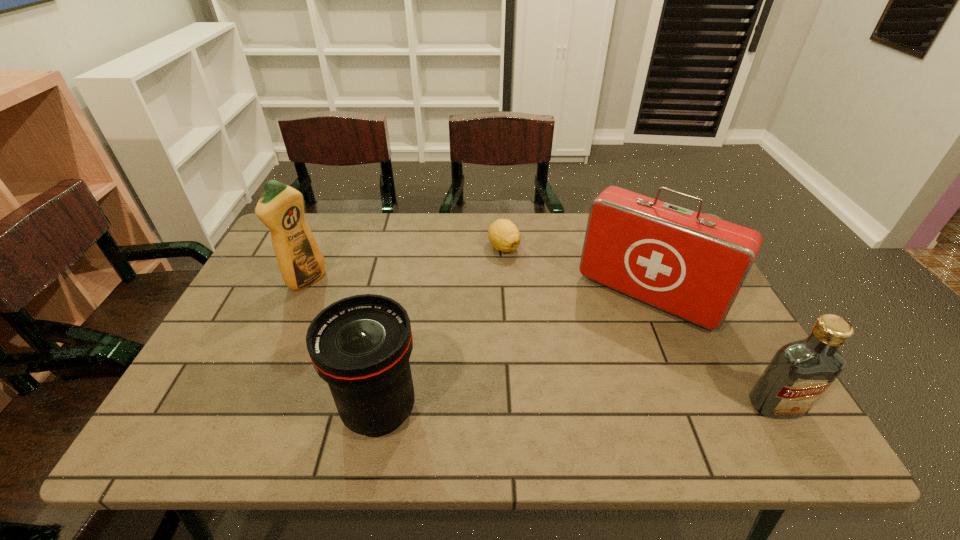
I want to click on vacant area that lies between the farthest object and the second object from left to right, so click(442, 329).

The width and height of the screenshot is (960, 540). I want to click on free spot between the farthest object and the first-aid kit, so click(x=576, y=272).

Find the location of a particular element. unoccupied position between the telephoto lens and the vodka is located at coordinates pos(578,408).

Locate an element on the screen. This screenshot has height=540, width=960. empty space between the vodka and the third object from left to right is located at coordinates (640, 326).

Locate an element on the screen. empty space that is in between the vodka and the lemon is located at coordinates (640, 326).

Where is `free space between the shortest object and the first-aid kit`? The height and width of the screenshot is (540, 960). free space between the shortest object and the first-aid kit is located at coordinates [576, 272].

Identify the location of free space between the vodka and the detergent. (541, 342).

Locate an element on the screen. The width and height of the screenshot is (960, 540). free point between the first-aid kit and the telephoto lens is located at coordinates (514, 353).

The image size is (960, 540). I want to click on object that is the second closest one to the farthest object, so click(360, 345).

What are the coordinates of `object that is the closest to the leftmost object` in the screenshot? It's located at (360, 345).